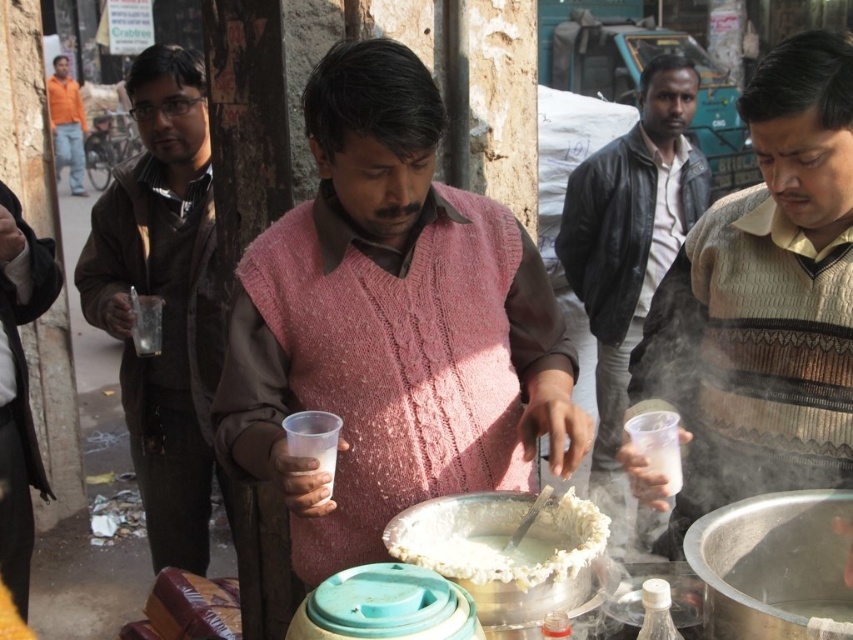
Is pink knitted sweater at center behind brown leather jacket at left?

No, pink knitted sweater at center is closer to the viewer.

Which is behind, point (331, 362) or point (161, 241)?

Positioned behind is point (161, 241).

Locate an element on the screen. The width and height of the screenshot is (853, 640). pink knitted sweater at center is located at coordinates (390, 324).

Who is positioned more to the right, pink knitted sweater at center or white creamy food at center?

white creamy food at center

You are a GUI agent. You are given a task and a screenshot of the screen. Output one action in this format:
    pyautogui.click(x=<x>, y=<y>)
    Task: Click on the pink knitted sweater at center
    
    Given the screenshot: What is the action you would take?
    pyautogui.click(x=390, y=324)

Locate an element on the screen. This screenshot has height=640, width=853. pink knitted sweater at center is located at coordinates (390, 324).

Between knitted sweater at center and brown leather jacket at left, which one is positioned lower?

knitted sweater at center

Consider the image. Between knitted sweater at center and brown leather jacket at left, which one has more height?

With more height is brown leather jacket at left.

Which is behind, point (743, 458) or point (200, 532)?

The point (200, 532) is behind.

You are a GUI agent. You are given a task and a screenshot of the screen. Output one action in this format:
    pyautogui.click(x=<x>, y=<y>)
    Task: Click on the knitted sweater at center
    
    Given the screenshot: What is the action you would take?
    pyautogui.click(x=764, y=300)